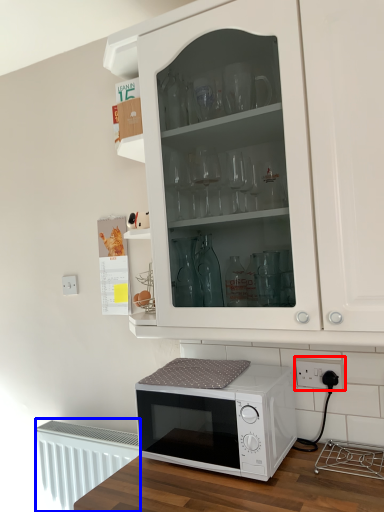
Question: Which object appears closest to the camera in this image, electric outlet (highlighted by a red box) or radiator (highlighted by a blue box)?

Choices:
 (A) electric outlet
 (B) radiator

Answer: (A)